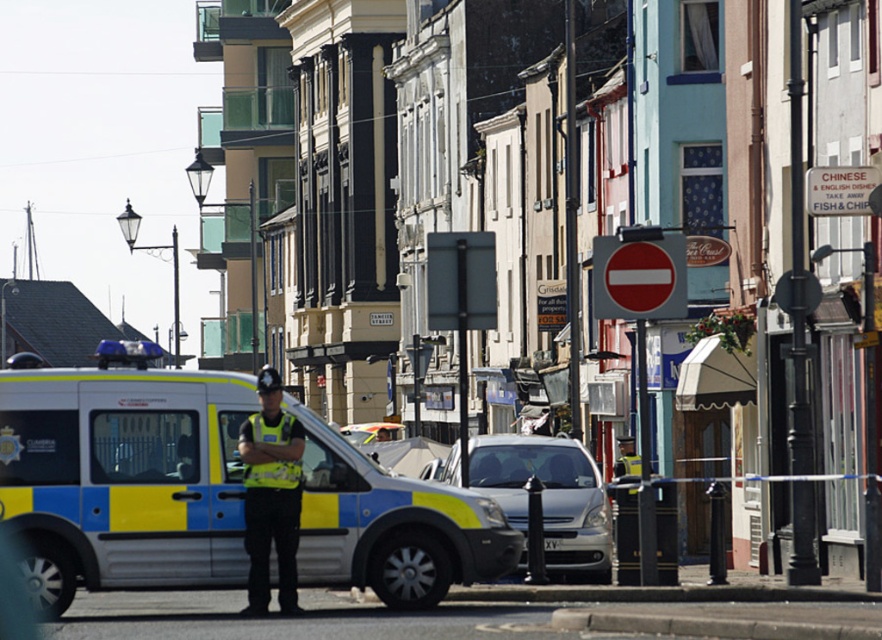
Does silver metallic sedan at center appear on the left side of neon yellow reflective vest at center?

In fact, silver metallic sedan at center is to the right of neon yellow reflective vest at center.

The height and width of the screenshot is (640, 882). Describe the element at coordinates (548, 497) in the screenshot. I see `silver metallic sedan at center` at that location.

Locate an element on the screen. silver metallic sedan at center is located at coordinates (548, 497).

You are a GUI agent. You are given a task and a screenshot of the screen. Output one action in this format:
    pyautogui.click(x=<x>, y=<y>)
    Task: Click on the silver metallic sedan at center
    
    Given the screenshot: What is the action you would take?
    pyautogui.click(x=548, y=497)

Can you confirm if silver metallic sedan at center is positioned above red plastic sign at center?

Incorrect, silver metallic sedan at center is not positioned above red plastic sign at center.

Which is behind, point (483, 472) or point (664, 289)?

Point (483, 472)

In order to click on silver metallic sedan at center in this screenshot , I will do `click(548, 497)`.

Is point (223, 400) positioned before point (546, 540)?

Yes, it is in front of point (546, 540).

Looking at this image, which of these two, yellow and blue van at center or silver metallic sedan at center, stands shorter?

silver metallic sedan at center is shorter.

Between point (250, 586) and point (588, 499), which one is positioned behind?

The point (588, 499) is more distant.

At what (x,y) coordinates should I click in order to perform the action: click on yellow and blue van at center. Please return your answer as a coordinate pair (x, y). This screenshot has width=882, height=640. Looking at the image, I should click on (215, 492).